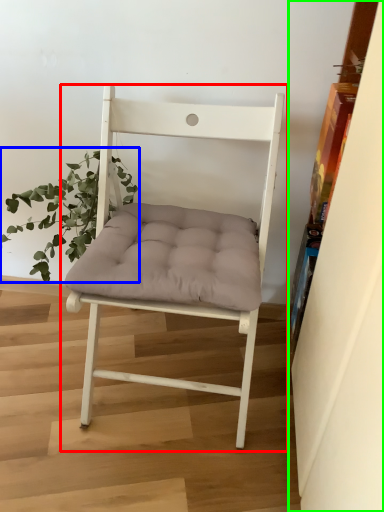
Question: Considering the real-world distances, which object is closest to chair (highlighted by a red box)? houseplant (highlighted by a blue box) or shelf (highlighted by a green box).

Choices:
 (A) houseplant
 (B) shelf

Answer: (A)